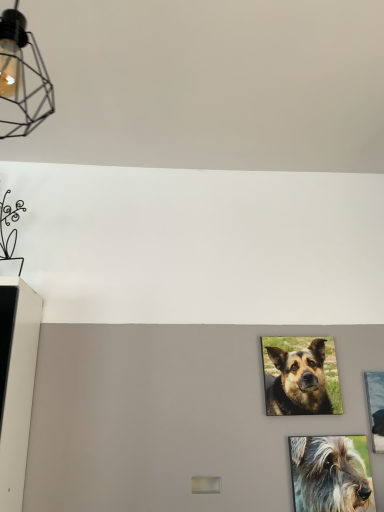
What do you see at coordinates (331, 474) in the screenshot? Image resolution: width=384 pixels, height=512 pixels. I see `shaggy gray dog at lower right, which is counted as the 1th dog, starting from the bottom` at bounding box center [331, 474].

Measure the distance between point (294, 494) and camera.

Point (294, 494) and camera are 5.10 feet apart.

Identify the location of brown fur dog at center, which is counted as the 1th dog, starting from the top. The height and width of the screenshot is (512, 384). (298, 381).

Is matte black wireframe light fixture at upper left spatially inside metallic silver picture frame at right, or outside of it?

The correct answer is: outside.

From a real-world perspective, is matte black wireframe light fixture at upper left on metallic silver picture frame at right?

Yes, from a real-world perspective, matte black wireframe light fixture at upper left is over metallic silver picture frame at right

How many degrees apart are the facing directions of matte black wireframe light fixture at upper left and metallic silver picture frame at right?

matte black wireframe light fixture at upper left and metallic silver picture frame at right are facing 90.3 degrees away from each other.

Between brown fur dog at center, which is counted as the 1th dog, starting from the top, and metallic silver picture frame at right, which one has larger width?

With larger width is metallic silver picture frame at right.

Between brown fur dog at center, which is the second dog from front to back, and metallic silver picture frame at right, which one has smaller size?

brown fur dog at center, which is the second dog from front to back, is smaller.

Considering the points (310, 346) and (375, 409), which point is behind, point (310, 346) or point (375, 409)?

Positioned behind is point (310, 346).

From a real-world perspective, which object stands above the other?

From a 3D spatial view, brown fur dog at center, which is the second dog from front to back, is above.

Is point (290, 399) positioned behind point (372, 497)?

Yes, point (290, 399) is behind point (372, 497).

Is shaggy gray dog at lower right, which is the 1th dog in front-to-back order, at the back of brown fur dog at center, the 2th dog when ordered from bottom to top?

No, shaggy gray dog at lower right, which is the 1th dog in front-to-back order, is not at the back of brown fur dog at center, the 2th dog when ordered from bottom to top.

Consider the image. Is brown fur dog at center, which is counted as the 1th dog, starting from the top, far from shaggy gray dog at lower right, which is the second dog from top to bottom?

No.

From the picture: From a real-world perspective, is brown fur dog at center, which is counted as the 1th dog, starting from the top, on top of shaggy gray dog at lower right, which is the 1th dog in front-to-back order?

Yes, from a real-world perspective, brown fur dog at center, which is counted as the 1th dog, starting from the top, is over shaggy gray dog at lower right, which is the 1th dog in front-to-back order

Relative to brown fur dog at center, which is the second dog from front to back, is matte black wireframe light fixture at upper left in front or behind?

In the image, matte black wireframe light fixture at upper left appears in front of brown fur dog at center, which is the second dog from front to back.

Considering the sizes of objects matte black wireframe light fixture at upper left and brown fur dog at center, which is counted as the 1th dog, starting from the back, in the image provided, who is taller, matte black wireframe light fixture at upper left or brown fur dog at center, which is counted as the 1th dog, starting from the back,?

matte black wireframe light fixture at upper left.

From the matte black wireframe light fixture at upper left, count 2nd dogs backward and point to it. Please provide its 2D coordinates.

[(298, 381)]

Measure the distance between matte black wireframe light fixture at upper left and brown fur dog at center, the 2th dog when ordered from bottom to top.

A distance of 1.31 meters exists between matte black wireframe light fixture at upper left and brown fur dog at center, the 2th dog when ordered from bottom to top.

The image size is (384, 512). I want to click on dog that is the 1st one when counting leftward from the metallic silver picture frame at right, so click(331, 474).

Are shaggy gray dog at lower right, which ranks as the second dog in back-to-front order, and metallic silver picture frame at right located far from each other?

Actually, shaggy gray dog at lower right, which ranks as the second dog in back-to-front order, and metallic silver picture frame at right are a little close together.

Is shaggy gray dog at lower right, which is the 1th dog in front-to-back order, not within metallic silver picture frame at right?

shaggy gray dog at lower right, which is the 1th dog in front-to-back order, is positioned outside metallic silver picture frame at right.

Considering the positions of point (306, 489) and point (383, 387), is point (306, 489) closer or farther from the camera than point (383, 387)?

Clearly, point (306, 489) is closer to the camera than point (383, 387).

Considering the relative positions of metallic silver picture frame at right and matte black wireframe light fixture at upper left in the image provided, is metallic silver picture frame at right to the right of matte black wireframe light fixture at upper left from the viewer's perspective?

Indeed, metallic silver picture frame at right is positioned on the right side of matte black wireframe light fixture at upper left.

This screenshot has height=512, width=384. What are the coordinates of `picture frame below the matte black wireframe light fixture at upper left (from a real-world perspective)` in the screenshot? It's located at (376, 408).

Between metallic silver picture frame at right and matte black wireframe light fixture at upper left, which one has smaller size?

With smaller size is metallic silver picture frame at right.

Does brown fur dog at center, the 2th dog when ordered from bottom to top, contain matte black wireframe light fixture at upper left?

No, matte black wireframe light fixture at upper left is located outside of brown fur dog at center, the 2th dog when ordered from bottom to top.

Would you say brown fur dog at center, which is counted as the 1th dog, starting from the top, is to the left or to the right of matte black wireframe light fixture at upper left in the picture?

Based on their positions, brown fur dog at center, which is counted as the 1th dog, starting from the top, is located to the right of matte black wireframe light fixture at upper left.

Is there a large distance between brown fur dog at center, which is the second dog from front to back, and matte black wireframe light fixture at upper left?

Yes, brown fur dog at center, which is the second dog from front to back, and matte black wireframe light fixture at upper left are located far from each other.

Is point (323, 352) more distant than point (50, 93)?

Yes, point (323, 352) is behind point (50, 93).

I want to click on picture frame to the right of matte black wireframe light fixture at upper left, so click(x=376, y=408).

At what (x,y) coordinates should I click in order to perform the action: click on dog that appears behind the metallic silver picture frame at right. Please return your answer as a coordinate pair (x, y). This screenshot has height=512, width=384. Looking at the image, I should click on (298, 381).

From the image, which object appears to be nearer to brown fur dog at center, which is counted as the 1th dog, starting from the back, metallic silver picture frame at right or shaggy gray dog at lower right, which is counted as the 1th dog, starting from the bottom?

Among the two, shaggy gray dog at lower right, which is counted as the 1th dog, starting from the bottom, is located nearer to brown fur dog at center, which is counted as the 1th dog, starting from the back.

Looking at the image, which one is located further to brown fur dog at center, the 2th dog when ordered from bottom to top, shaggy gray dog at lower right, which is the 1th dog in front-to-back order, or matte black wireframe light fixture at upper left?

Based on the image, matte black wireframe light fixture at upper left appears to be further to brown fur dog at center, the 2th dog when ordered from bottom to top.

When comparing their distances from matte black wireframe light fixture at upper left, does brown fur dog at center, the 2th dog when ordered from bottom to top, or shaggy gray dog at lower right, which is the second dog from top to bottom, seem closer?

brown fur dog at center, the 2th dog when ordered from bottom to top, is closer to matte black wireframe light fixture at upper left.

In the scene shown: Considering their positions, is brown fur dog at center, which is counted as the 1th dog, starting from the back, positioned closer to metallic silver picture frame at right than shaggy gray dog at lower right, which is counted as the 1th dog, starting from the bottom?

The object closer to metallic silver picture frame at right is shaggy gray dog at lower right, which is counted as the 1th dog, starting from the bottom.

From the image, which object appears to be farther from matte black wireframe light fixture at upper left, shaggy gray dog at lower right, which ranks as the second dog in back-to-front order, or brown fur dog at center, which is the second dog from front to back?

shaggy gray dog at lower right, which ranks as the second dog in back-to-front order.

From the image, which object appears to be farther from metallic silver picture frame at right, shaggy gray dog at lower right, which is the second dog from top to bottom, or brown fur dog at center, which is counted as the 1th dog, starting from the back?

Based on the image, brown fur dog at center, which is counted as the 1th dog, starting from the back, appears to be further to metallic silver picture frame at right.

Estimate the real-world distances between objects in this image. Which object is closer to matte black wireframe light fixture at upper left, metallic silver picture frame at right or brown fur dog at center, which is the second dog from front to back?

brown fur dog at center, which is the second dog from front to back, lies closer to matte black wireframe light fixture at upper left than the other object.

From the image, which object appears to be farther from matte black wireframe light fixture at upper left, shaggy gray dog at lower right, which is the 1th dog in front-to-back order, or metallic silver picture frame at right?

metallic silver picture frame at right is further to matte black wireframe light fixture at upper left.

Locate an element on the screen. dog between matte black wireframe light fixture at upper left and shaggy gray dog at lower right, which is the second dog from top to bottom, from top to bottom is located at coordinates (298, 381).

At what (x,y) coordinates should I click in order to perform the action: click on dog between brown fur dog at center, which is counted as the 1th dog, starting from the top, and metallic silver picture frame at right. Please return your answer as a coordinate pair (x, y). The width and height of the screenshot is (384, 512). Looking at the image, I should click on (331, 474).

You are a GUI agent. You are given a task and a screenshot of the screen. Output one action in this format:
    pyautogui.click(x=<x>, y=<y>)
    Task: Click on the picture frame that lies between matte black wireframe light fixture at upper left and shaggy gray dog at lower right, which ranks as the second dog in back-to-front order, from top to bottom
    
    Given the screenshot: What is the action you would take?
    pyautogui.click(x=376, y=408)